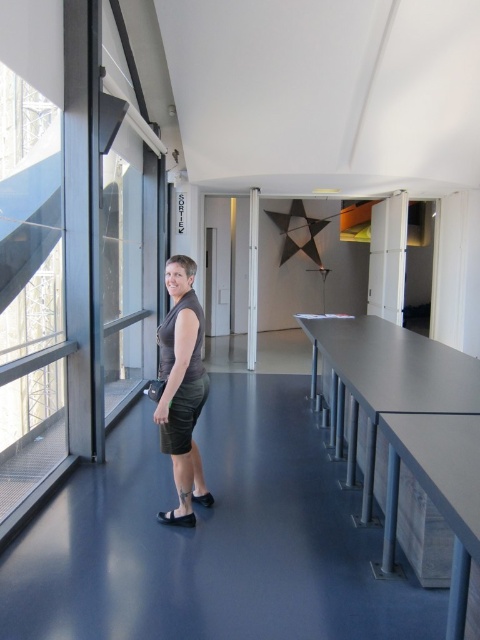
You are standing in the room and want to pick up the black suede sandal at lower center and the black leather sandal at lower center. Which one would you need to bend down less to pick up?

The black suede sandal at lower center is closer to the viewer than the black leather sandal at lower center, so you would need to bend down less to pick up the black suede sandal at lower center.

You are a visitor in this space and want to place a 1.5 meter long decorative bench between the woman and the white glossy pillar at center. Is there enough space for the bench to fit without overlapping either the woman or the pillar?

The distance between the woman and the white glossy pillar at center is 7.20 meters. Since the bench is only 1.5 meters long, there is sufficient space to place it between them without overlapping either object.